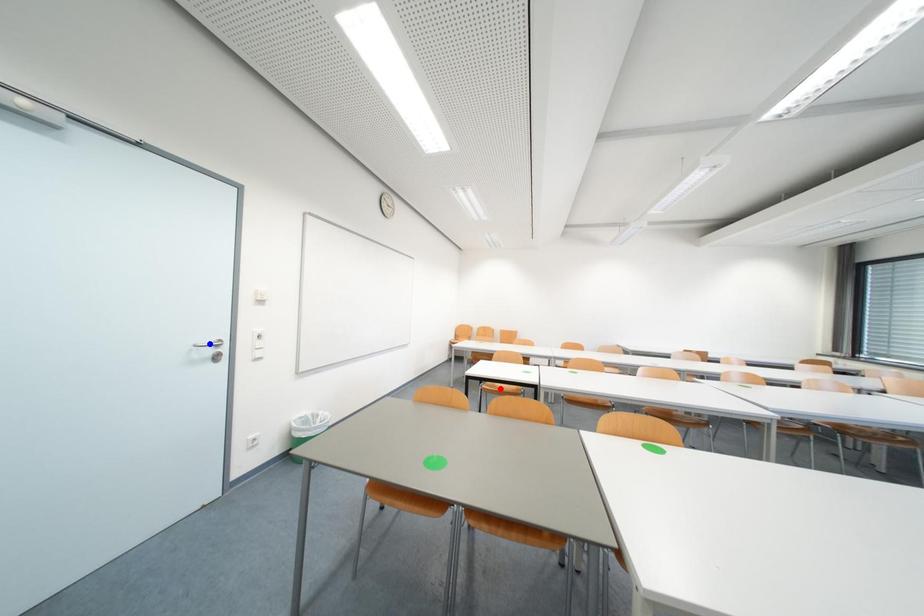
Question: Which of the two points in the image is closer to the camera?

Choices:
 (A) Blue point is closer.
 (B) Red point is closer.

Answer: (A)